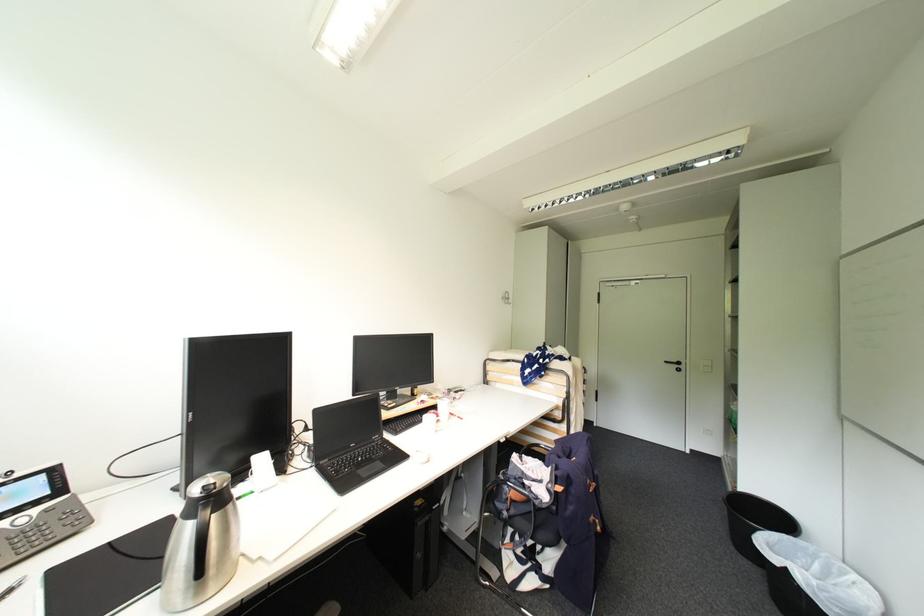
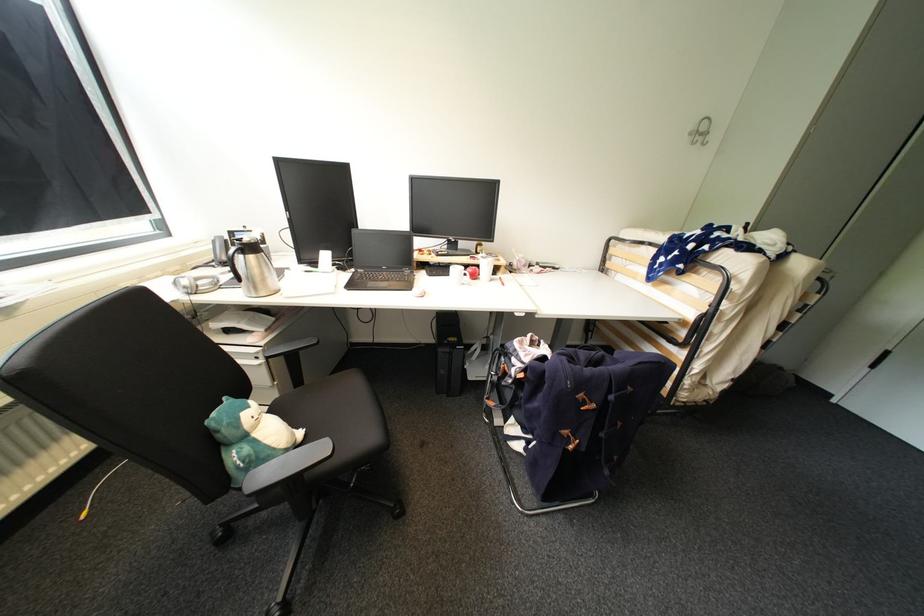
Looking at this image, the images are taken continuously from a first-person perspective. In which direction is your viewpoint rotating?

The rotation direction of the camera is left-down.